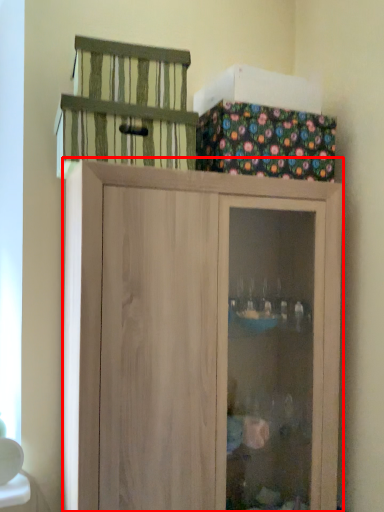
Question: From the image's perspective, what is the correct spatial relationship of cupboard (annotated by the red box) in relation to cage?

Choices:
 (A) below
 (B) above

Answer: (A)